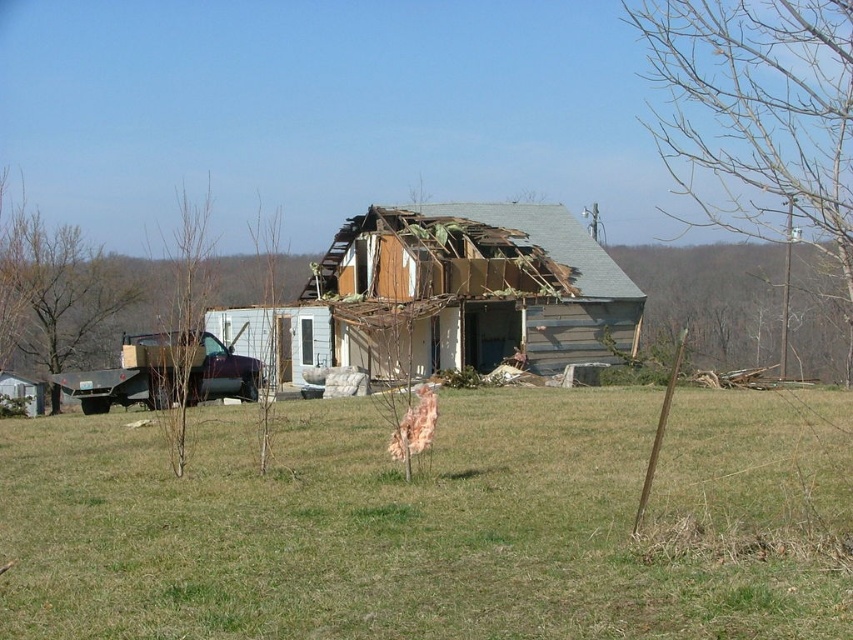
You are a construction worker who needs to assess the height of the green grass at center and the wooden house at center in the scene. Which one is taller?

The wooden house at center is taller than the green grass at center.

You are standing at point (x=503, y=232) and want to walk to the house. Is point (x=329, y=552) between you and the house?

Yes, point (x=329, y=552) is between you and the house because it is in front of point (x=503, y=232), which is your current position.